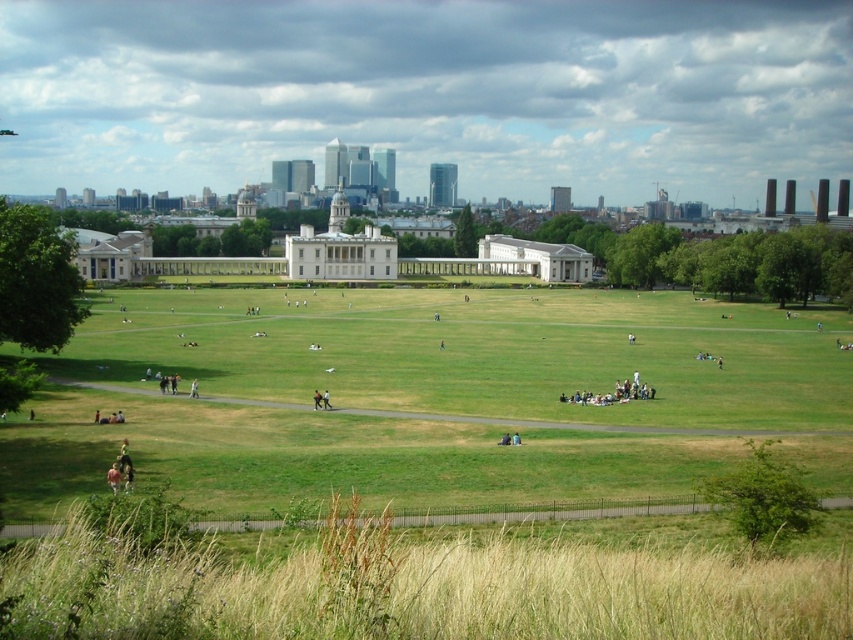
Does transparent glass skyscrapers at center have a greater height compared to dark blue jeans at center?

Indeed, transparent glass skyscrapers at center has a greater height compared to dark blue jeans at center.

Is point (166, 172) behind point (315, 394)?

Yes.

Identify the location of transparent glass skyscrapers at center. (430, 93).

Is dark blue jeans at center to the left of orange fabric person at center from the viewer's perspective?

Yes, dark blue jeans at center is to the left of orange fabric person at center.

Does dark blue jeans at center lie behind orange fabric person at center?

Yes.

Identify the location of dark blue jeans at center. The image size is (853, 640). (317, 400).

Locate an element on the screen. dark blue jeans at center is located at coordinates (317, 400).

Is green grass at center positioned at the back of dark blue jeans at center?

That is False.

Between point (693, 301) and point (314, 404), which one is positioned in front?

Point (314, 404) is more forward.

Locate an element on the screen. green grass at center is located at coordinates (418, 396).

Locate an element on the screen. green grass at center is located at coordinates (418, 396).